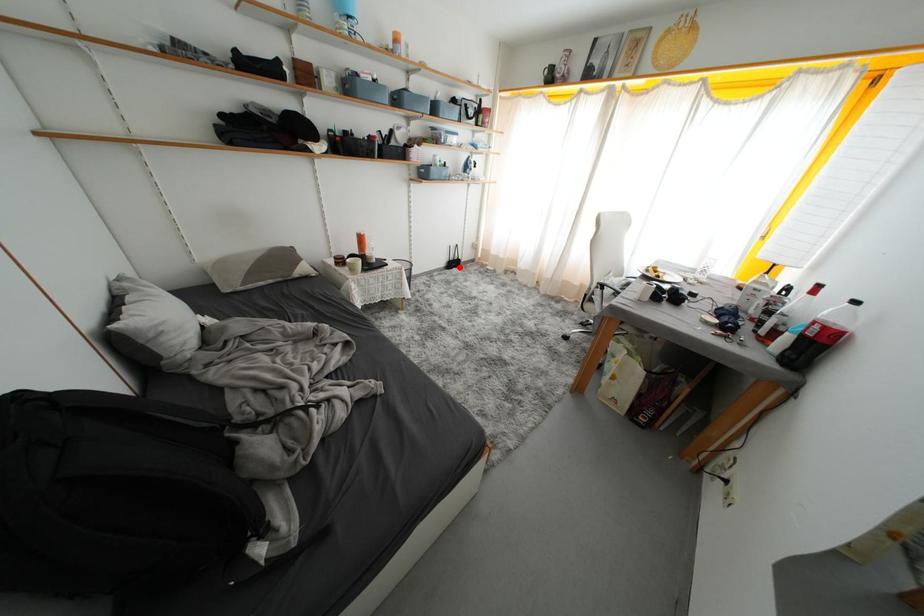
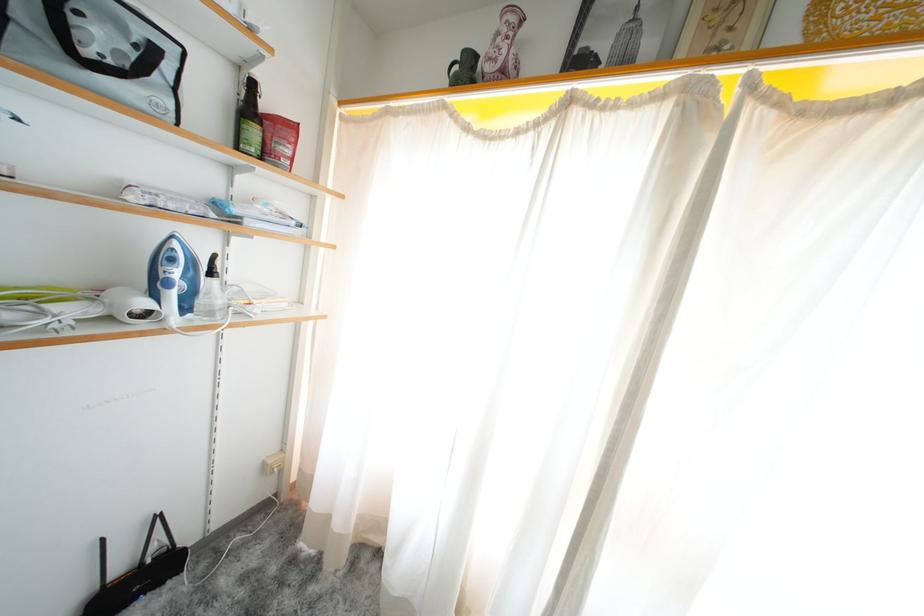
Question: I am providing you with two images of the same scene from different viewpoints. A red point is shown in image1. For the corresponding object point in image2, is it positioned nearer or farther from the camera?

Choices:
 (A) Nearer
 (B) Farther

Answer: (A)